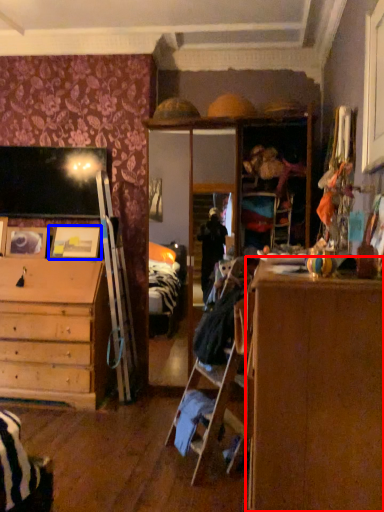
Question: Which object appears farthest to the camera in this image, cabinetry (highlighted by a red box) or picture frame (highlighted by a blue box)?

Choices:
 (A) cabinetry
 (B) picture frame

Answer: (B)